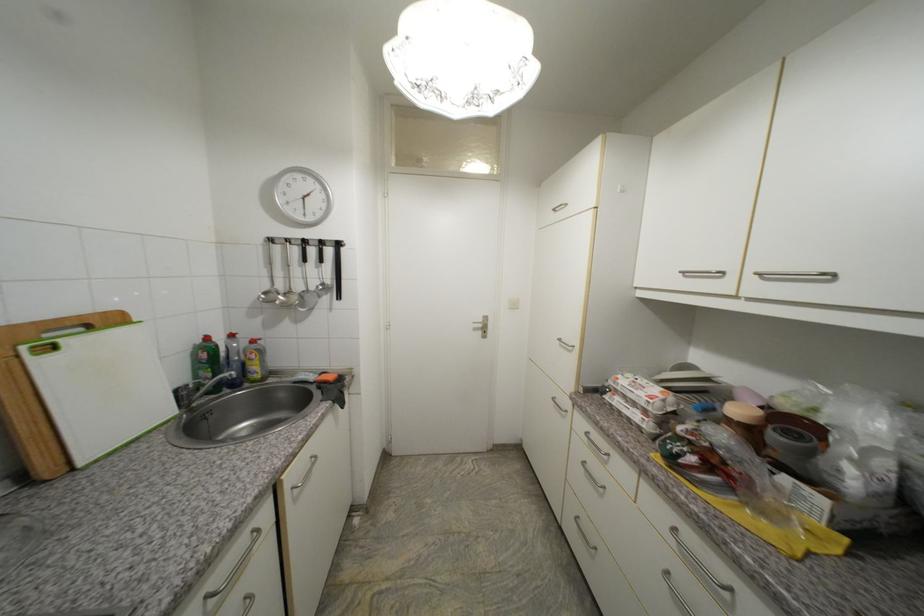
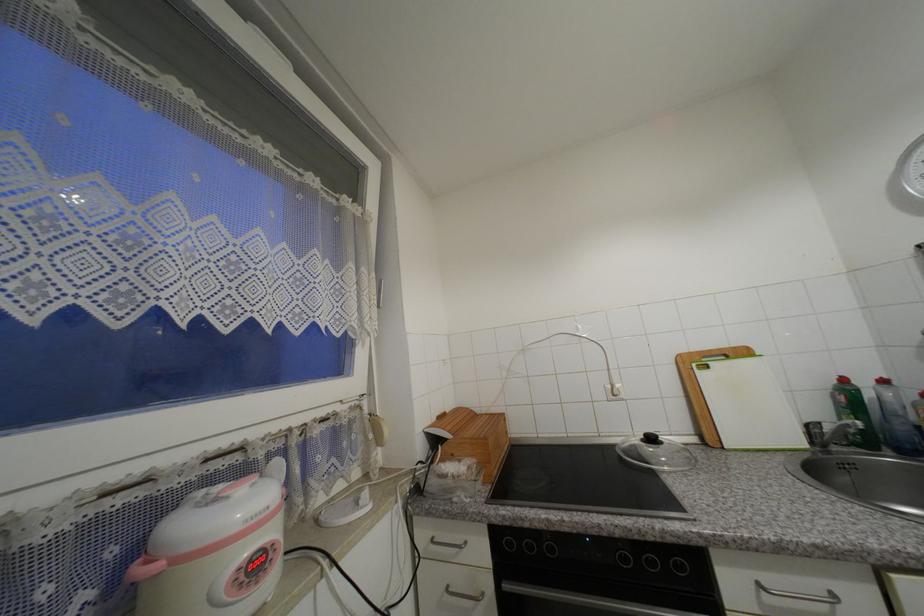
Question: How did the camera likely rotate?

Choices:
 (A) Left
 (B) Right
 (C) Up
 (D) Down

Answer: (A)